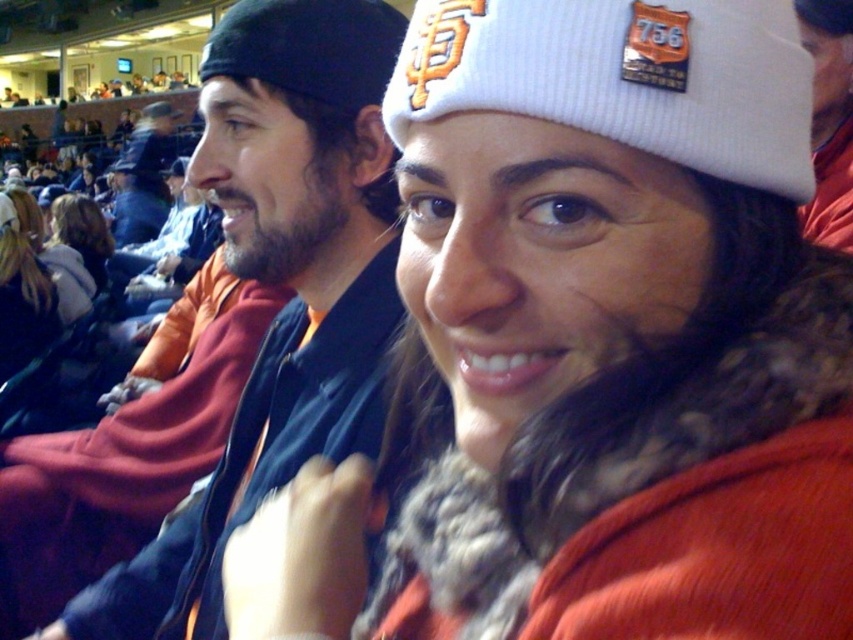
You are a photographer trying to capture a group photo of the orange fleece jacket at center and the white fur coat at center. Which object should you focus on if you want to ensure both are fully visible in the frame without cropping?

The orange fleece jacket at center occupies less space than the white fur coat at center, so you should focus on the white fur coat at center to ensure both are fully visible in the frame without cropping.

In the scene shown: You are at a sports event and see two people wearing jackets. The first is an orange fleece jacket at center, and the second is a white fur coat at center. Which one is positioned to the right?

Result: The orange fleece jacket at center is positioned to the right of the white fur coat at center.

You are a photographer at the event and want to capture a photo of the blonde hair at center and the white fur coat at center. Which object should you zoom in on to ensure it appears larger in the photo?

The white fur coat at center is larger than the blonde hair at center, so you should zoom in on the white fur coat at center to make it appear larger in the photo.